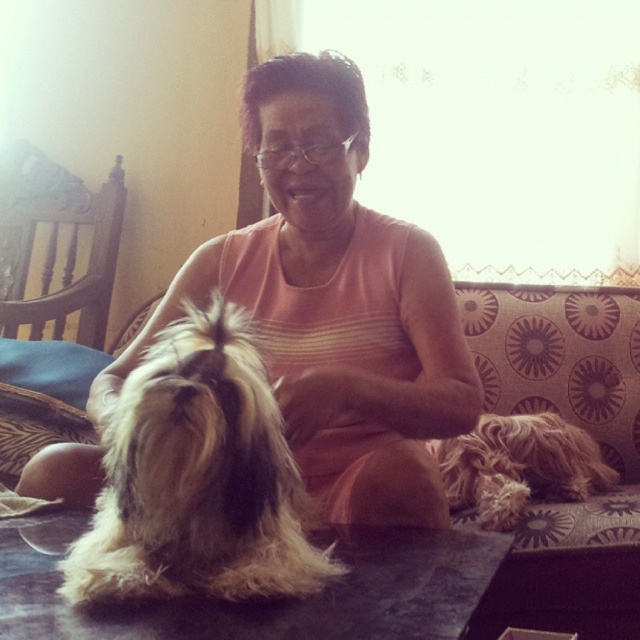
Question: From the image, what is the correct spatial relationship of matte peach shirt at center in relation to fuzzy brown dog at center?

Choices:
 (A) left
 (B) right

Answer: (B)

Question: Does matte peach shirt at center have a greater width compared to patterned fabric couch at center?

Choices:
 (A) yes
 (B) no

Answer: (A)

Question: Which of the following is the closest to the observer?

Choices:
 (A) (49, 401)
 (B) (605, 465)

Answer: (B)

Question: Which point appears farthest from the camera in this image?

Choices:
 (A) (451, 285)
 (B) (506, 522)

Answer: (B)

Question: Which point is farther to the camera?

Choices:
 (A) fuzzy brown dog at center
 (B) patterned fabric couch at center
 (C) fuzzy brown dog at lower right
 (D) matte peach shirt at center

Answer: (C)

Question: Is fuzzy brown dog at center thinner than patterned fabric couch at center?

Choices:
 (A) yes
 (B) no

Answer: (A)